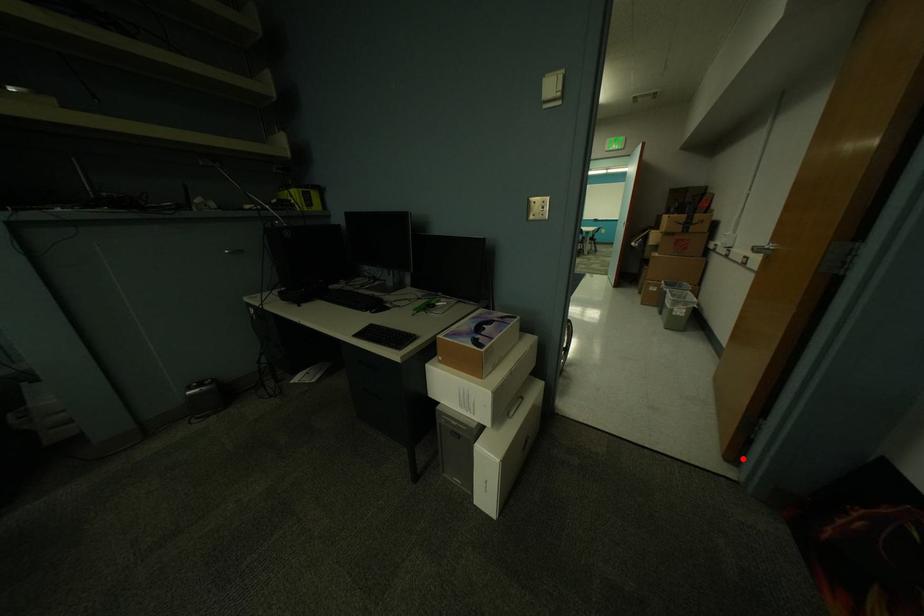
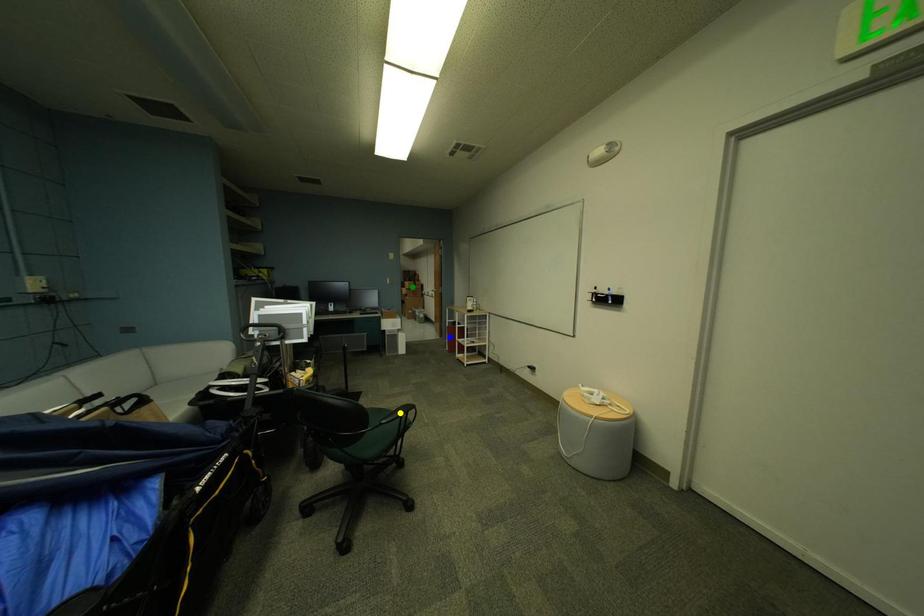
Question: I am providing you with two images of the same scene from different viewpoints. A red point is marked on the first image. You are given multiple points on the second image. Which point in image 2 represents the same 3d spot as the red point in image 1?

Choices:
 (A) yellow point
 (B) blue point
 (C) green point

Answer: (B)